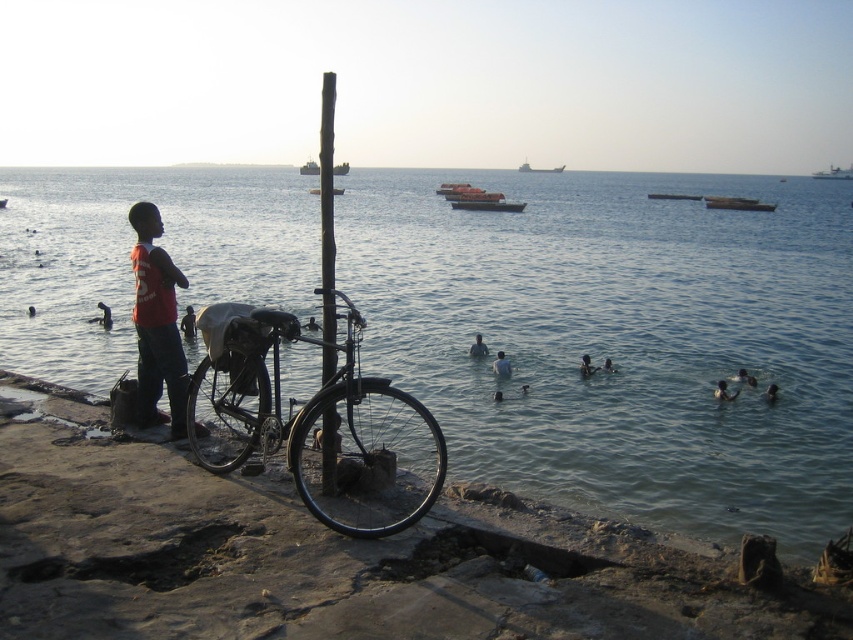
Consider the image. You are standing on the embankment and want to walk to the clear water at lower center. Which direction should you move relative to the smooth black pole at center?

To reach the clear water at lower center, you should move to the right of the smooth black pole at center since the clear water at lower center is located to its right.